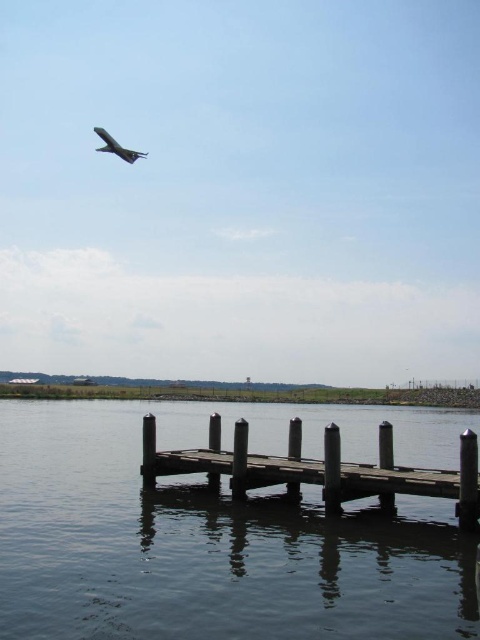
You are standing on the smooth wooden dock at lower center and want to walk to the wooden dock at center. Based on their sizes, which dock will feel more stable under your feet?

The smooth wooden dock at lower center is larger in size than the wooden dock at center, so it will feel more stable under your feet.

You are standing on the lakeside and looking at the wooden dock at center and the metallic silver airplane at upper left. Which object is positioned more to the east if the sun is setting in the west?

The metallic silver airplane at upper left is positioned more to the east because it is to the left of the wooden dock at center, and since the sun is setting in the west, left would correspond to the east direction.

You are standing on the wooden dock and looking towards the shoreline. There are two points marked on the dock, one at coordinates point (10, 516) and the other at point (108, 145). Which point is closer to you as you stand on the dock?

Point (10, 516) is closer to you because it is further to the camera than point (108, 145), meaning it is nearer to your position on the dock.